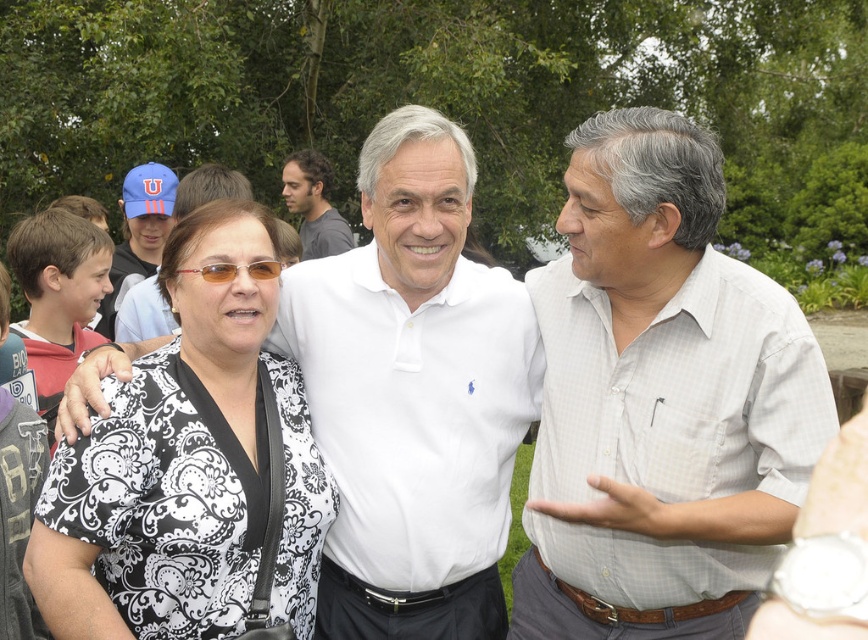
You are organizing a clothing donation drive and need to categorize shirts based on their sizes. You have a white cotton shirt at center and a dark gray shirt at upper center. Which shirt should you place in the small size bin?

The white cotton shirt at center has a smaller size compared to the dark gray shirt at upper center, so it should be placed in the small size bin.

You are taking a photo of the group and want to ensure both the white cotton shirt at center and the dark gray shirt at upper center are clearly visible. Which shirt is located lower in the image?

The white cotton shirt at center is positioned under the dark gray shirt at upper center, so the white cotton shirt at center is lower in the image.

You are a photographer standing 10 feet away from the two subjects in the image. You want to capture a photo where both the white checkered shirt at center and the black printed blouse at center are in focus. Given that your camera has a depth of field that can sharply focus on objects within a 40 inch range, will both subjects be in focus?

The white checkered shirt at center is 35.73 inches from the black printed blouse at center. Since the distance between them is less than the camera s 40 inch depth of field range, both subjects will be in focus.